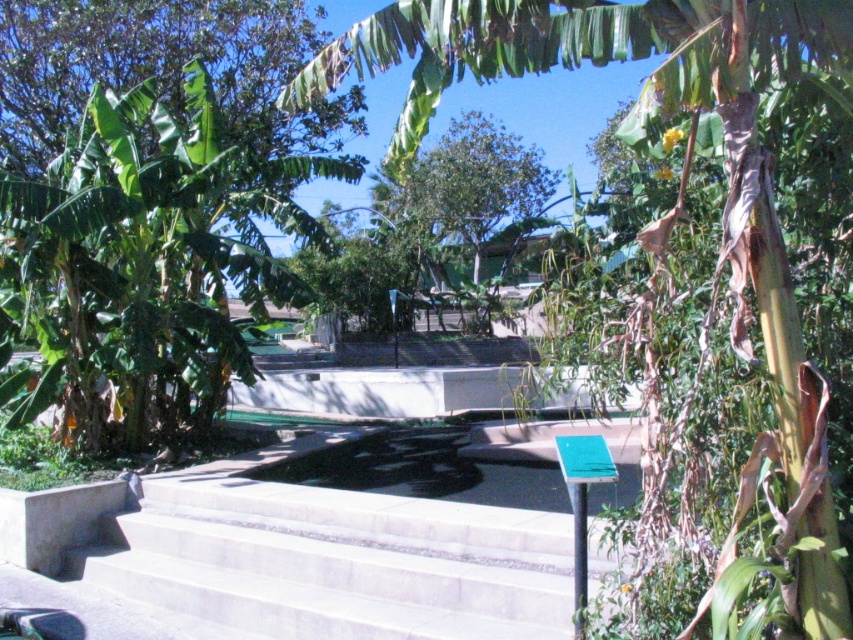
Question: Which point is farther to the camera?

Choices:
 (A) green leafy banana tree at center
 (B) concrete stairs at center

Answer: (B)

Question: Can you confirm if concrete stairs at center is thinner than green leafy banana tree at center?

Choices:
 (A) yes
 (B) no

Answer: (B)

Question: Observing the image, what is the correct spatial positioning of concrete stairs at center in reference to green leafy banana tree at center?

Choices:
 (A) right
 (B) left

Answer: (B)

Question: Among these objects, which one is nearest to the camera?

Choices:
 (A) concrete stairs at center
 (B) green leafy banana tree at center

Answer: (B)

Question: In this image, where is concrete stairs at center located relative to green leafy banana tree at center?

Choices:
 (A) above
 (B) below

Answer: (B)